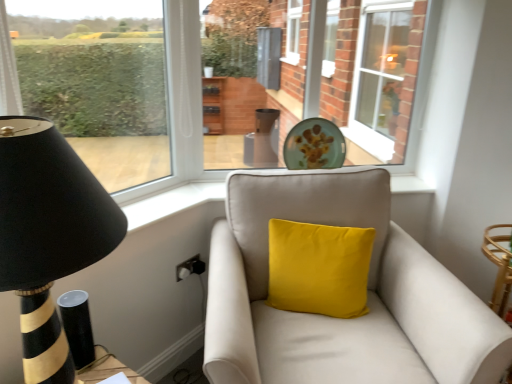
Question: From a real-world perspective, is suede beige couch at center below clear glass window at upper right, the second window positioned from the left?

Choices:
 (A) no
 (B) yes

Answer: (B)

Question: From the image's perspective, would you say suede beige couch at center is shown under clear glass window at upper right, which is the 1th window in back-to-front order?

Choices:
 (A) yes
 (B) no

Answer: (A)

Question: From a real-world perspective, is suede beige couch at center positioned over clear glass window at upper right, which is the 1th window in back-to-front order, based on gravity?

Choices:
 (A) yes
 (B) no

Answer: (B)

Question: Considering the relative sizes of suede beige couch at center and clear glass window at upper right, which ranks as the second window in front-to-back order, in the image provided, is suede beige couch at center smaller than clear glass window at upper right, which ranks as the second window in front-to-back order,?

Choices:
 (A) no
 (B) yes

Answer: (A)

Question: Does suede beige couch at center have a larger size compared to clear glass window at upper right, the second window positioned from the left?

Choices:
 (A) no
 (B) yes

Answer: (B)

Question: Is yellow velvet cushion at center wider or thinner than clear glass window at upper right, which is the 1th window in back-to-front order?

Choices:
 (A) wide
 (B) thin

Answer: (A)

Question: Is yellow velvet cushion at center taller or shorter than clear glass window at upper right, which is the 1th window in back-to-front order?

Choices:
 (A) tall
 (B) short

Answer: (B)

Question: Looking at the image, does yellow velvet cushion at center seem bigger or smaller compared to clear glass window at upper right, which appears as the first window when viewed from the right?

Choices:
 (A) big
 (B) small

Answer: (B)

Question: Which is correct: yellow velvet cushion at center is inside clear glass window at upper right, which ranks as the second window in front-to-back order, or outside of it?

Choices:
 (A) inside
 (B) outside

Answer: (B)

Question: Looking at their shapes, would you say clear glass window at upper right, the second window positioned from the left, is wider or thinner than suede beige couch at center?

Choices:
 (A) thin
 (B) wide

Answer: (A)

Question: From the image's perspective, is clear glass window at upper right, which is the 1th window in back-to-front order, positioned above or below suede beige couch at center?

Choices:
 (A) below
 (B) above

Answer: (B)

Question: Considering the positions of clear glass window at upper right, which appears as the first window when viewed from the right, and suede beige couch at center in the image, is clear glass window at upper right, which appears as the first window when viewed from the right, taller or shorter than suede beige couch at center?

Choices:
 (A) tall
 (B) short

Answer: (A)

Question: Is point (389, 125) positioned closer to the camera than point (259, 241)?

Choices:
 (A) farther
 (B) closer

Answer: (A)

Question: In terms of height, does clear glass window at upper right, the second window positioned from the left, look taller or shorter compared to transparent glass window at left, which ranks as the 1th window in left-to-right order?

Choices:
 (A) short
 (B) tall

Answer: (B)

Question: From the image's perspective, is clear glass window at upper right, which ranks as the second window in front-to-back order, positioned above or below transparent glass window at left, which ranks as the 1th window in left-to-right order?

Choices:
 (A) below
 (B) above

Answer: (B)